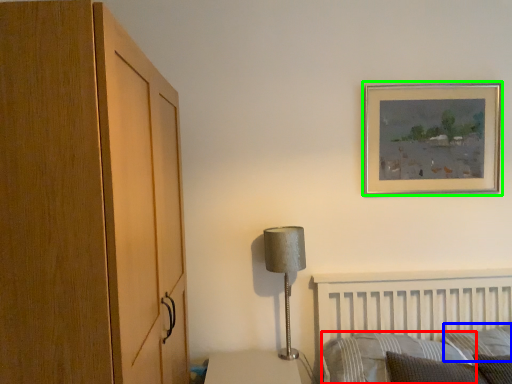
Question: Estimate the real-world distances between objects in this image. Which object is farther from pillow (highlighted by a red box), pillow (highlighted by a blue box) or picture frame (highlighted by a green box)?

Choices:
 (A) pillow
 (B) picture frame

Answer: (B)